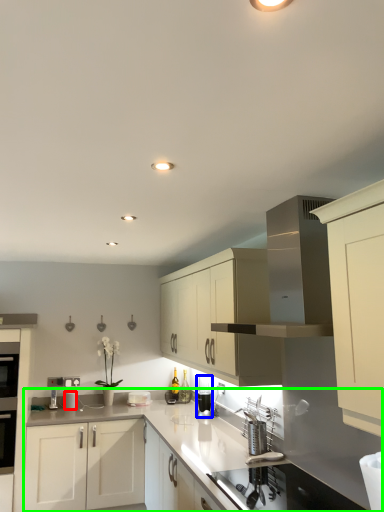
Question: Considering the real-world distances, which object is closest to appliance (highlighted by a red box)? appliance (highlighted by a blue box) or countertop (highlighted by a green box).

Choices:
 (A) appliance
 (B) countertop

Answer: (B)